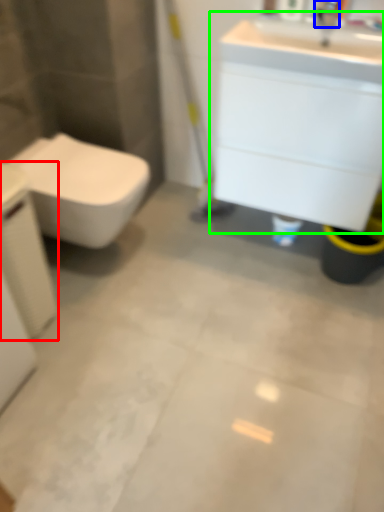
Question: Based on their relative distances, which object is nearer to porcelain (highlighted by a red box)? Choose from faucet (highlighted by a blue box) and bathroom cabinet (highlighted by a green box).

Choices:
 (A) faucet
 (B) bathroom cabinet

Answer: (B)